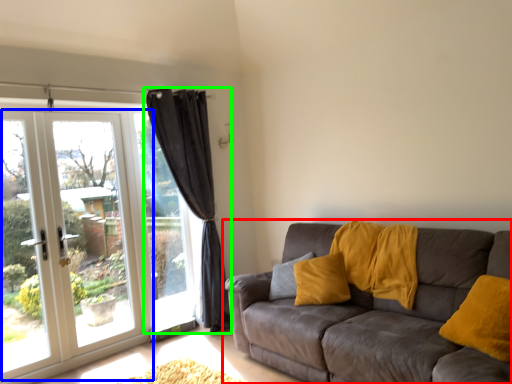
Question: Which is farther away from studio couch (highlighted by a red box)? door (highlighted by a blue box) or curtain (highlighted by a green box)?

Choices:
 (A) door
 (B) curtain

Answer: (A)